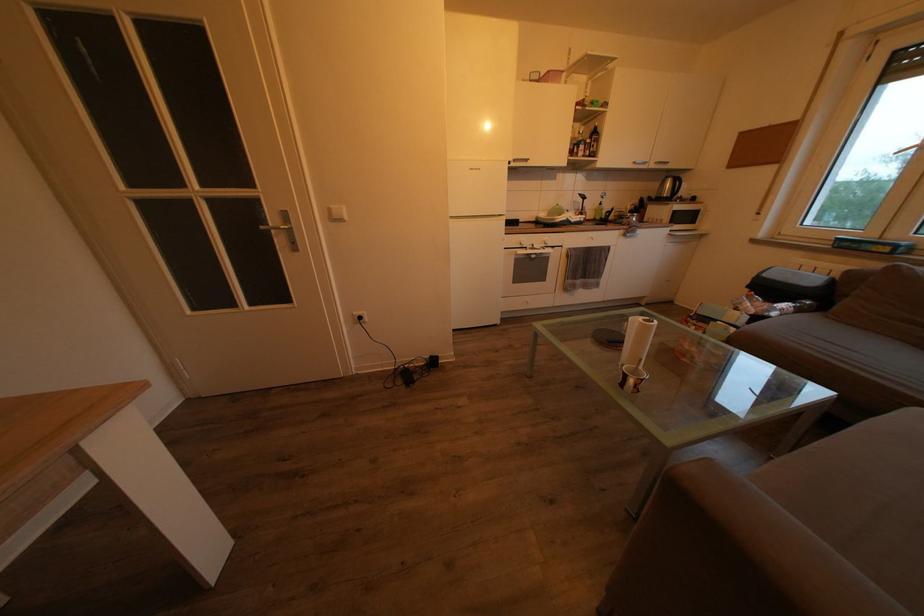
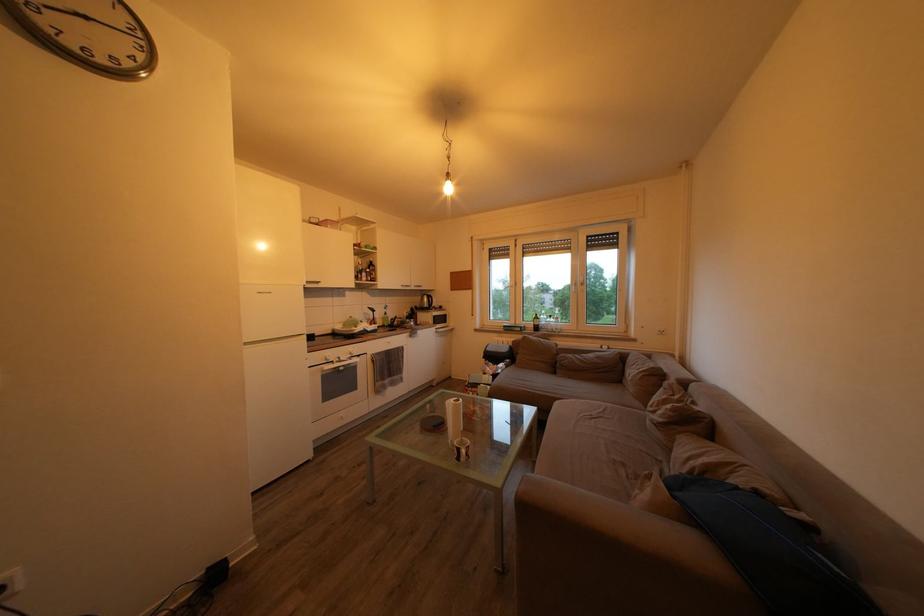
Where in the second image is the point corresponding to (x=591, y=204) from the first image?

(381, 317)